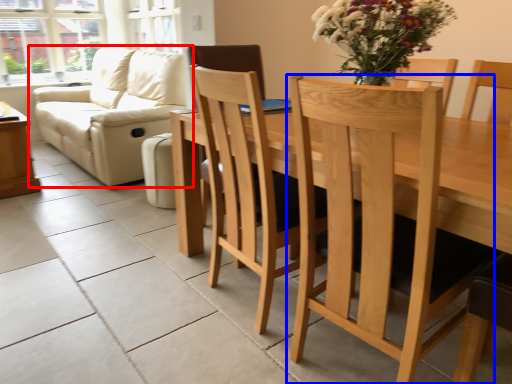
Question: Among these objects, which one is nearest to the camera, studio couch (highlighted by a red box) or chair (highlighted by a blue box)?

Choices:
 (A) studio couch
 (B) chair

Answer: (B)